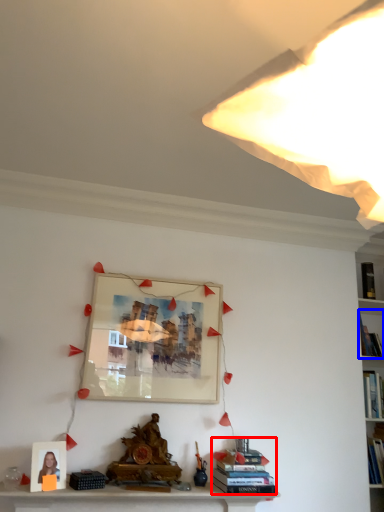
Question: Which of the following is the farthest to the observer, book (highlighted by a red box) or book (highlighted by a blue box)?

Choices:
 (A) book
 (B) book

Answer: (B)